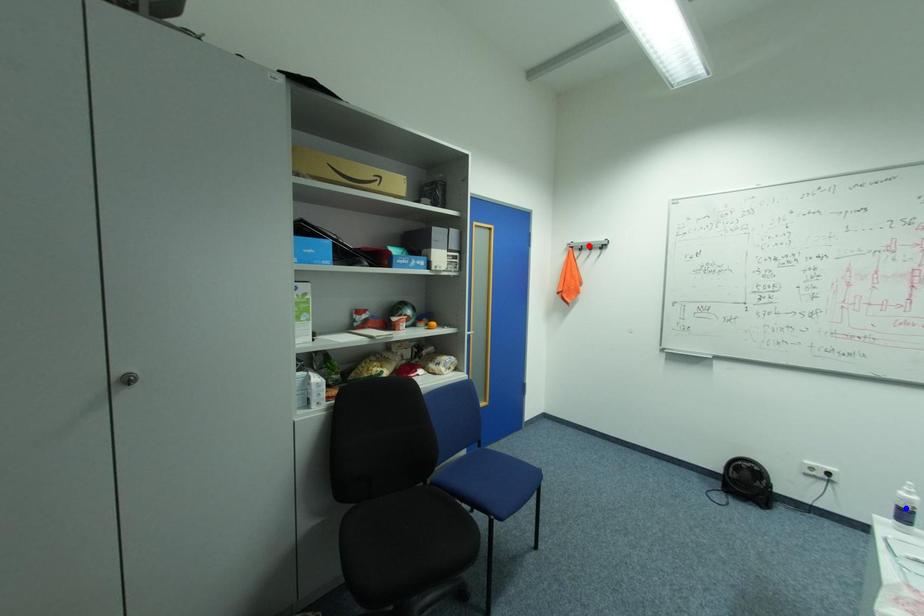
Question: Two points are marked on the image. Which point is closer to the camera?

Choices:
 (A) Blue point is closer.
 (B) Red point is closer.

Answer: (A)